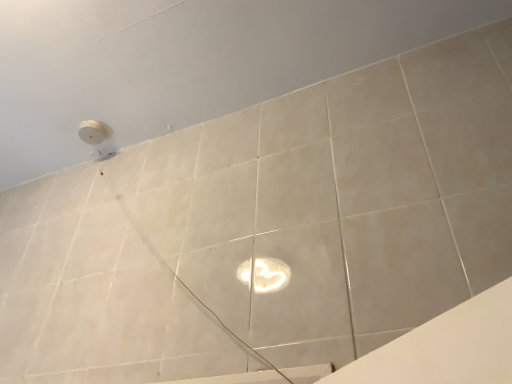
The image size is (512, 384). Describe the element at coordinates (92, 132) in the screenshot. I see `white matte droplight at upper left` at that location.

At what (x,y) coordinates should I click in order to perform the action: click on white matte droplight at upper left. Please return your answer as a coordinate pair (x, y). The width and height of the screenshot is (512, 384). Looking at the image, I should click on (92, 132).

This screenshot has width=512, height=384. Find the location of `white matte droplight at upper left`. white matte droplight at upper left is located at coordinates tap(92, 132).